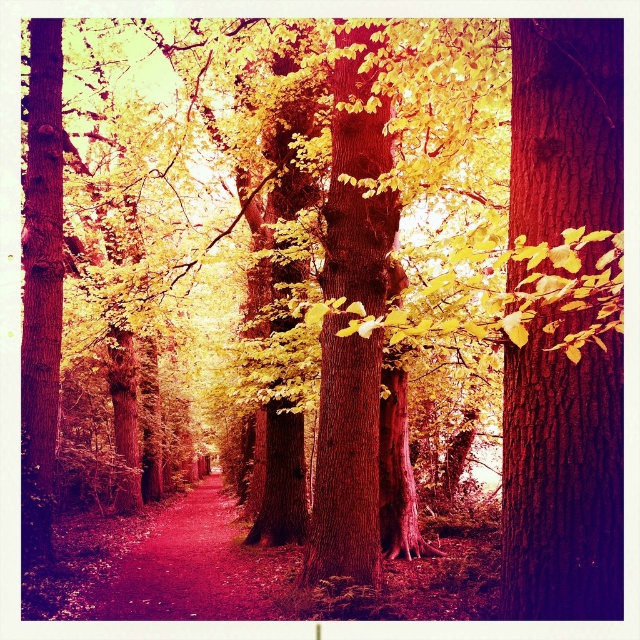
Question: Does smooth bark tree at right appear over smooth dirt path at center?

Choices:
 (A) yes
 (B) no

Answer: (A)

Question: In this image, where is smooth bark tree at right located relative to smooth dirt path at center?

Choices:
 (A) left
 (B) right

Answer: (B)

Question: Does smooth bark tree at right appear on the right side of smooth dirt path at center?

Choices:
 (A) no
 (B) yes

Answer: (B)

Question: Which of the following is the closest to the observer?

Choices:
 (A) smooth dirt path at center
 (B) smooth bark tree at right

Answer: (B)